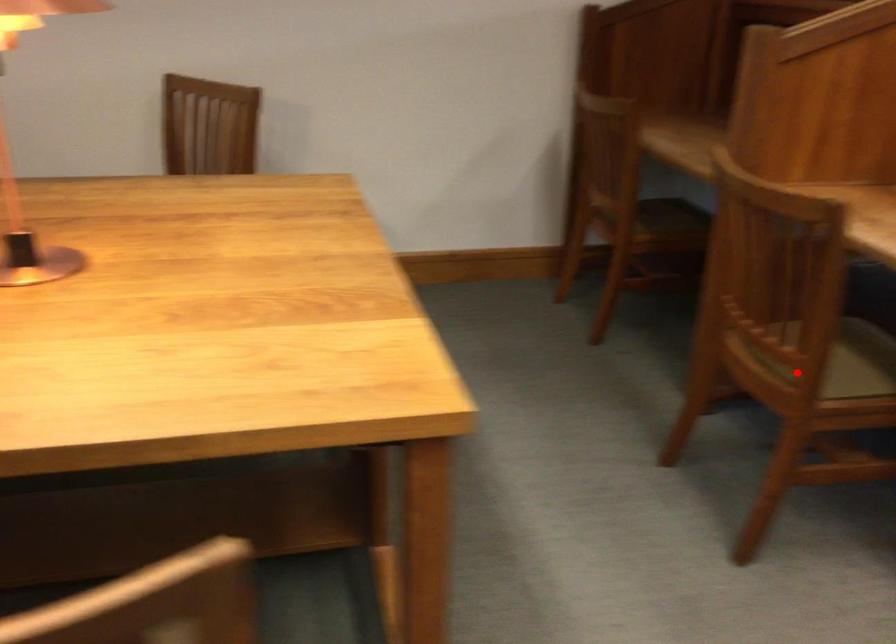
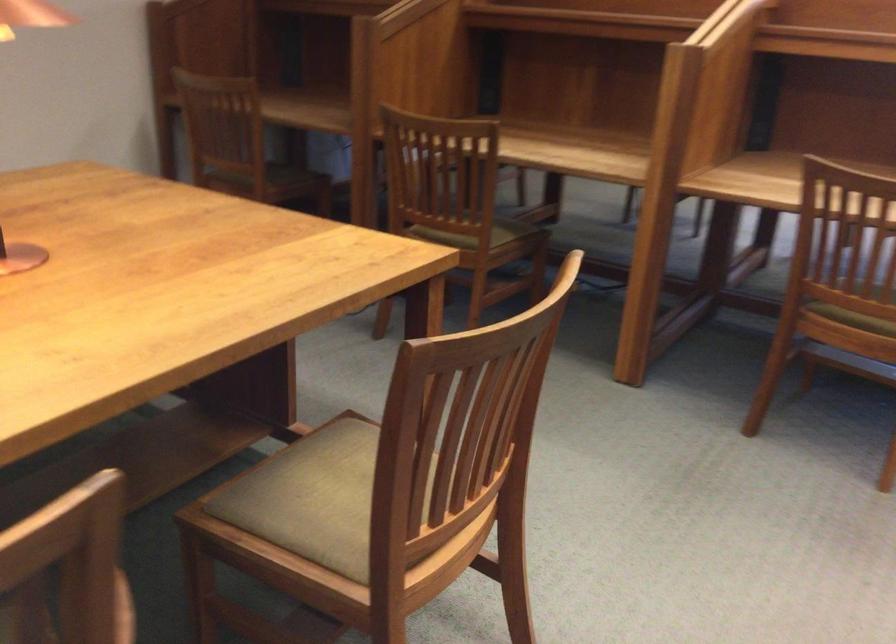
Question: I am providing you with two images of the same scene from different viewpoints. Given a red point in image1, look at the same physical point in image2. Is it:

Choices:
 (A) Closer to the viewpoint
 (B) Farther from the viewpoint

Answer: (B)